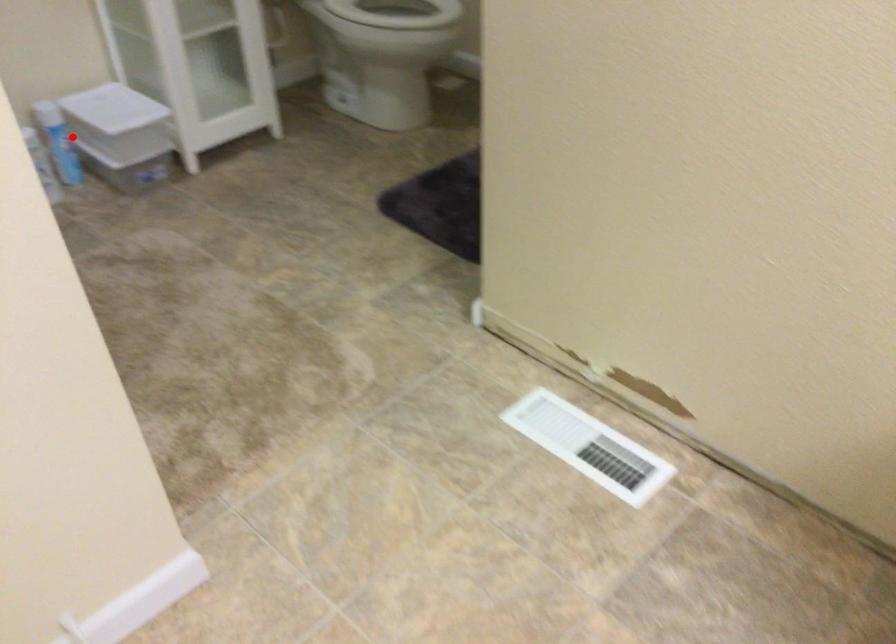
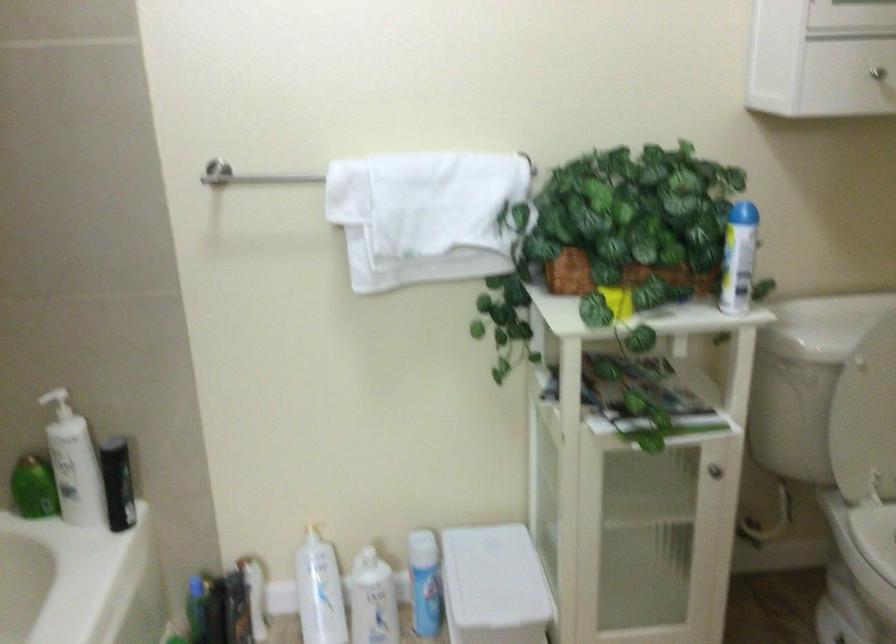
Question: I am providing you with two images of the same scene from different viewpoints. A red point is shown in image1. For the corresponding object point in image2, is it positioned nearer or farther from the camera?

Choices:
 (A) Nearer
 (B) Farther

Answer: (A)